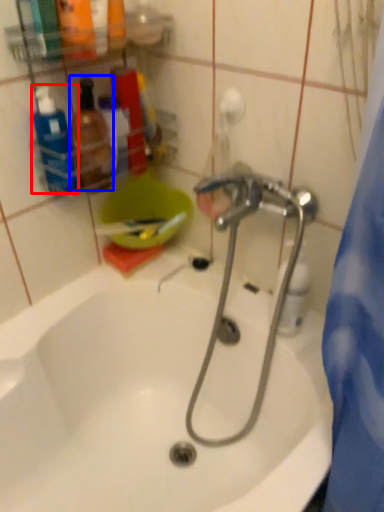
Question: Which point is closer to the camera, cleaning product (highlighted by a red box) or toiletry (highlighted by a blue box)?

Choices:
 (A) cleaning product
 (B) toiletry

Answer: (A)